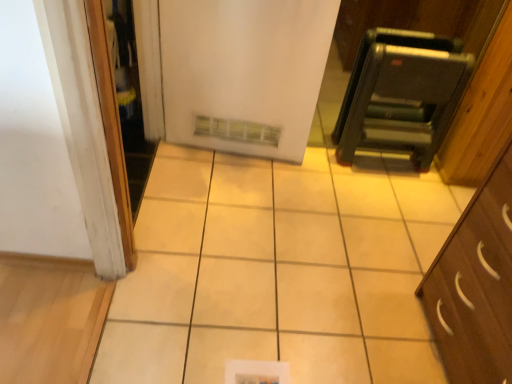
Locate an element on the screen. Image resolution: width=512 pixels, height=384 pixels. free spot below metallic black step ladder at upper right (from a real-world perspective) is located at coordinates (380, 155).